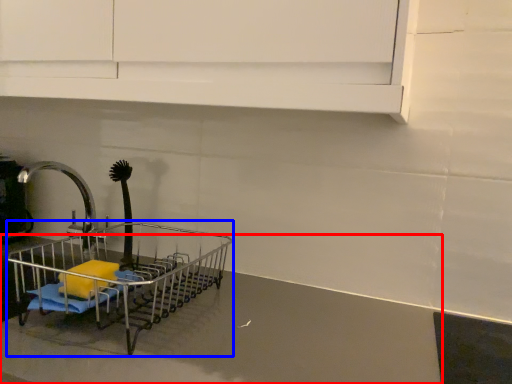
Question: Among these objects, which one is farthest to the camera, counter top (highlighted by a red box) or shopping cart (highlighted by a blue box)?

Choices:
 (A) counter top
 (B) shopping cart

Answer: (B)